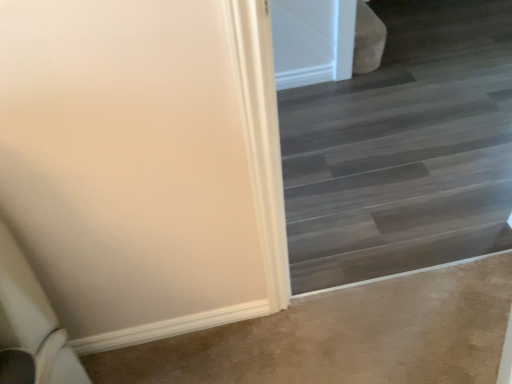
Image resolution: width=512 pixels, height=384 pixels. I want to click on free space to the back side of dark wood floor at center, so click(377, 172).